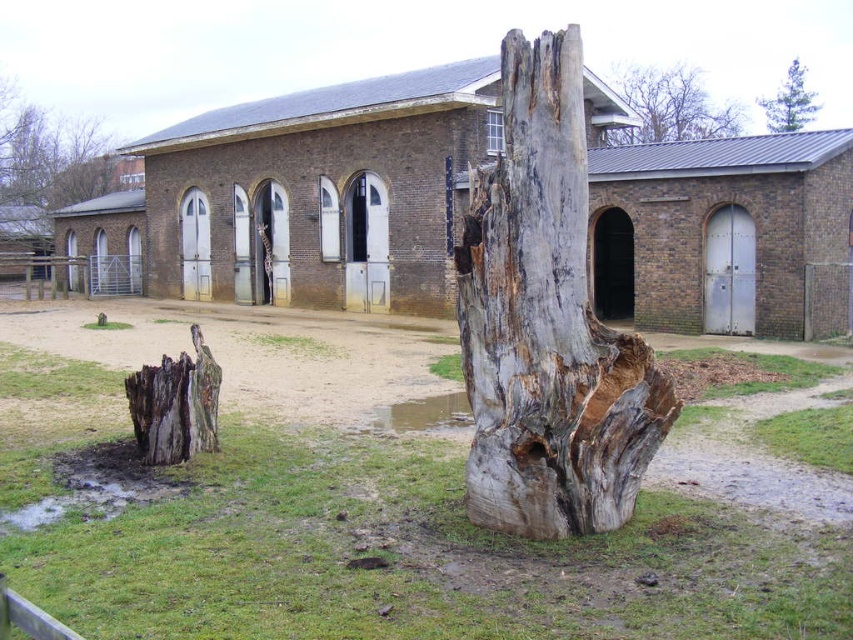
You are a gardener planning to place a new decorative stone path between the gray rough bark tree stump at upper center and the green textured pine tree at upper right. Given the space between them, can you fit a path that is 2 meters wide?

The gray rough bark tree stump at upper center is wider than the green textured pine tree at upper right. However, the exact distance between them isn

You are a park maintenance worker who needs to place a 8 meter long wooden plank between the gray rough bark tree stump at upper center and the green textured pine tree at upper right. Can you fit the plank between them without bending it?

The distance between the gray rough bark tree stump at upper center and the green textured pine tree at upper right is 7.71 meters. Since the plank is 8 meters long, it is slightly longer than the distance between them. Therefore, the plank cannot be placed straight between them without bending.

You are a painter setting up an easel to paint the brown brick building at center and the brown rough tree stump at upper left. You want to ensure your painting accurately reflects their relative sizes. Which object should you make wider in your artwork?

You should make the brown brick building at center wider in your artwork because its width is larger than the brown rough tree stump at upper left.